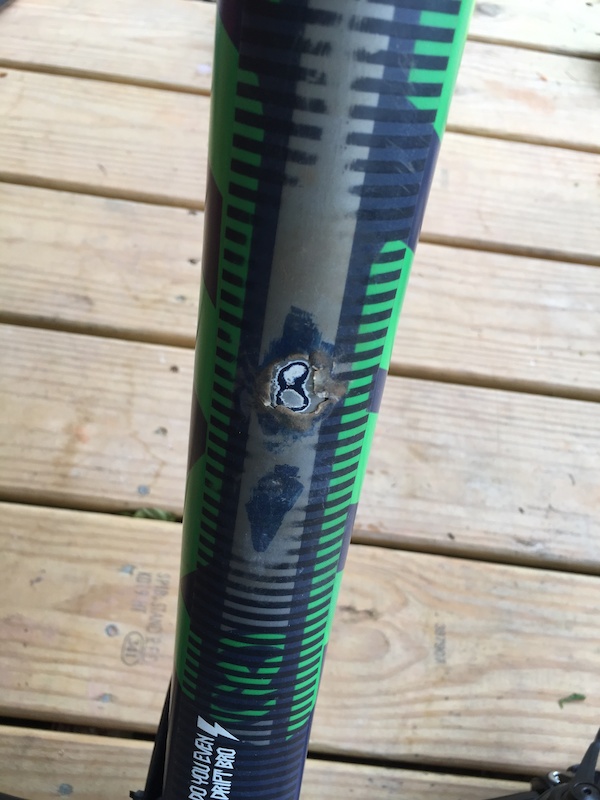
Where is `wood floor`? Image resolution: width=600 pixels, height=800 pixels. wood floor is located at coordinates (529, 352).